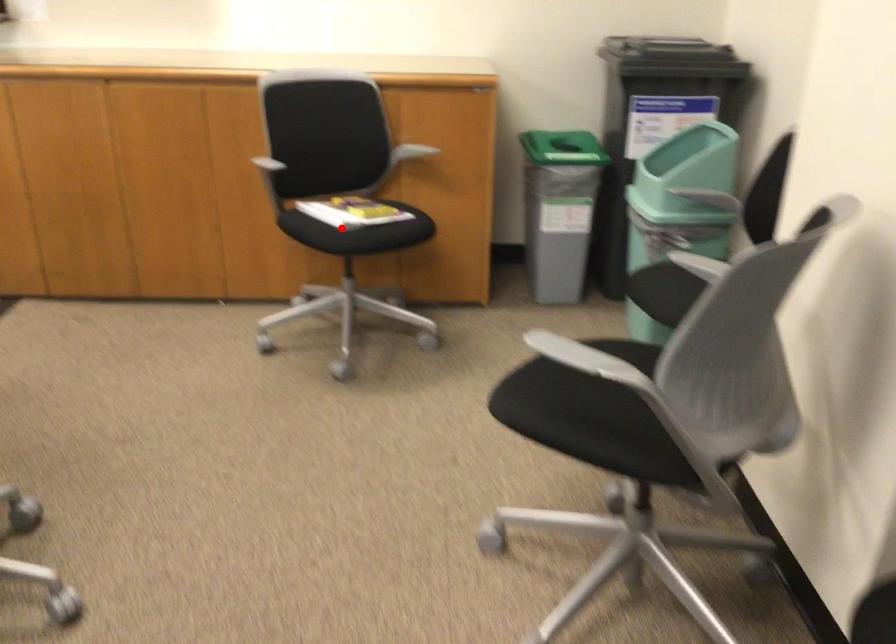
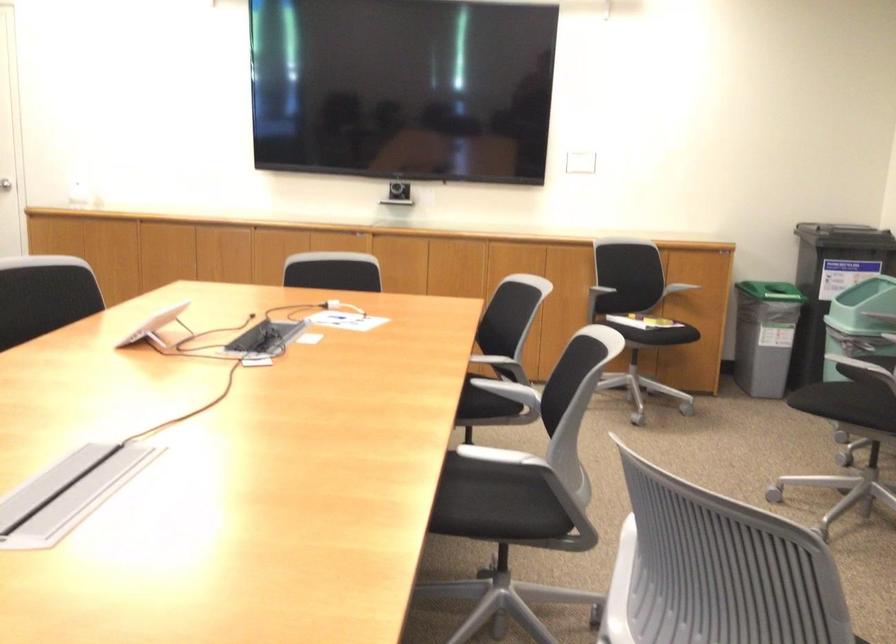
Question: I am providing you with two images of the same scene from different viewpoints. Image1 has a red point marked. In image2, the corresponding 3D location appears at what relative position? Reply with the corresponding letter.

Choices:
 (A) Closer
 (B) Farther

Answer: (B)